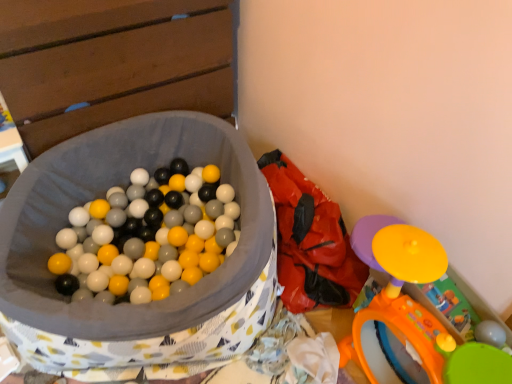
Image resolution: width=512 pixels, height=384 pixels. Describe the element at coordinates (415, 322) in the screenshot. I see `orange plastic toy at lower right` at that location.

Find the location of a particular element. This screenshot has height=384, width=512. orange plastic toy at lower right is located at coordinates (415, 322).

Image resolution: width=512 pixels, height=384 pixels. Describe the element at coordinates (310, 241) in the screenshot. I see `red fabric bean bag chair at center` at that location.

Locate an element on the screen. red fabric bean bag chair at center is located at coordinates (310, 241).

Measure the distance between red fabric bean bag chair at center and camera.

red fabric bean bag chair at center and camera are 4.42 feet apart.

Find the location of a particular element. orange plastic toy at lower right is located at coordinates (415, 322).

From the picture: Which object is positioned more to the right, red fabric bean bag chair at center or orange plastic toy at lower right?

Positioned to the right is orange plastic toy at lower right.

Considering the positions of objects red fabric bean bag chair at center and orange plastic toy at lower right in the image provided, who is in front, red fabric bean bag chair at center or orange plastic toy at lower right?

Positioned in front is orange plastic toy at lower right.

Considering the points (317, 201) and (455, 377), which point is behind, point (317, 201) or point (455, 377)?

Point (317, 201)

In the scene shown: From the image's perspective, which one is positioned lower, red fabric bean bag chair at center or orange plastic toy at lower right?

From the image's view, orange plastic toy at lower right is below.

From a real-world perspective, is red fabric bean bag chair at center positioned over orange plastic toy at lower right based on gravity?

No, from a real-world perspective, red fabric bean bag chair at center is not over orange plastic toy at lower right

Is red fabric bean bag chair at center thinner than orange plastic toy at lower right?

In fact, red fabric bean bag chair at center might be wider than orange plastic toy at lower right.

Does red fabric bean bag chair at center have a greater height compared to orange plastic toy at lower right?

In fact, red fabric bean bag chair at center may be shorter than orange plastic toy at lower right.

Based on the photo, considering the sizes of objects red fabric bean bag chair at center and orange plastic toy at lower right in the image provided, who is bigger, red fabric bean bag chair at center or orange plastic toy at lower right?

red fabric bean bag chair at center is bigger.

Is red fabric bean bag chair at center located outside orange plastic toy at lower right?

Indeed, red fabric bean bag chair at center is completely outside orange plastic toy at lower right.

Is red fabric bean bag chair at center positioned far away from orange plastic toy at lower right?

Actually, red fabric bean bag chair at center and orange plastic toy at lower right are a little close together.

Is red fabric bean bag chair at center facing towards orange plastic toy at lower right?

No, red fabric bean bag chair at center is not oriented towards orange plastic toy at lower right.

In the scene shown: Can you tell me how much red fabric bean bag chair at center and orange plastic toy at lower right differ in facing direction?

The angle between the facing direction of red fabric bean bag chair at center and the facing direction of orange plastic toy at lower right is 1.33 degrees.

Identify the location of bean bag chair located behind the orange plastic toy at lower right. The image size is (512, 384). (310, 241).

Does orange plastic toy at lower right appear on the right side of red fabric bean bag chair at center?

Yes, orange plastic toy at lower right is to the right of red fabric bean bag chair at center.

Is orange plastic toy at lower right positioned behind red fabric bean bag chair at center?

No.

Between point (340, 343) and point (297, 195), which one is positioned in front?

The point (340, 343) is closer.

From the image's perspective, which one is positioned lower, orange plastic toy at lower right or red fabric bean bag chair at center?

orange plastic toy at lower right.

From a real-world perspective, which object rests below the other?

In real-world perspective, red fabric bean bag chair at center is lower.

Is orange plastic toy at lower right thinner than red fabric bean bag chair at center?

Indeed, orange plastic toy at lower right has a lesser width compared to red fabric bean bag chair at center.

Considering the sizes of orange plastic toy at lower right and red fabric bean bag chair at center in the image, is orange plastic toy at lower right taller or shorter than red fabric bean bag chair at center?

orange plastic toy at lower right is taller than red fabric bean bag chair at center.

Considering the relative sizes of orange plastic toy at lower right and red fabric bean bag chair at center in the image provided, is orange plastic toy at lower right bigger than red fabric bean bag chair at center?

No.

Would you say orange plastic toy at lower right contains red fabric bean bag chair at center?

Definitely not — red fabric bean bag chair at center is not inside orange plastic toy at lower right.

Is orange plastic toy at lower right directly adjacent to red fabric bean bag chair at center?

No, orange plastic toy at lower right is not in contact with red fabric bean bag chair at center.

Is orange plastic toy at lower right aimed at red fabric bean bag chair at center?

No, orange plastic toy at lower right is not aimed at red fabric bean bag chair at center.

In the scene shown: How much distance is there between orange plastic toy at lower right and red fabric bean bag chair at center?

orange plastic toy at lower right is 11.47 inches away from red fabric bean bag chair at center.

Find the location of `toy located above the red fabric bean bag chair at center (from a real-world perspective)`. toy located above the red fabric bean bag chair at center (from a real-world perspective) is located at coordinates coord(415,322).

In the image, there is a orange plastic toy at lower right. At what (x,y) coordinates should I click in order to perform the action: click on bean bag chair below it (from a real-world perspective). Please return your answer as a coordinate pair (x, y). The image size is (512, 384). Looking at the image, I should click on (310, 241).

I want to click on toy located on the right of red fabric bean bag chair at center, so click(x=415, y=322).